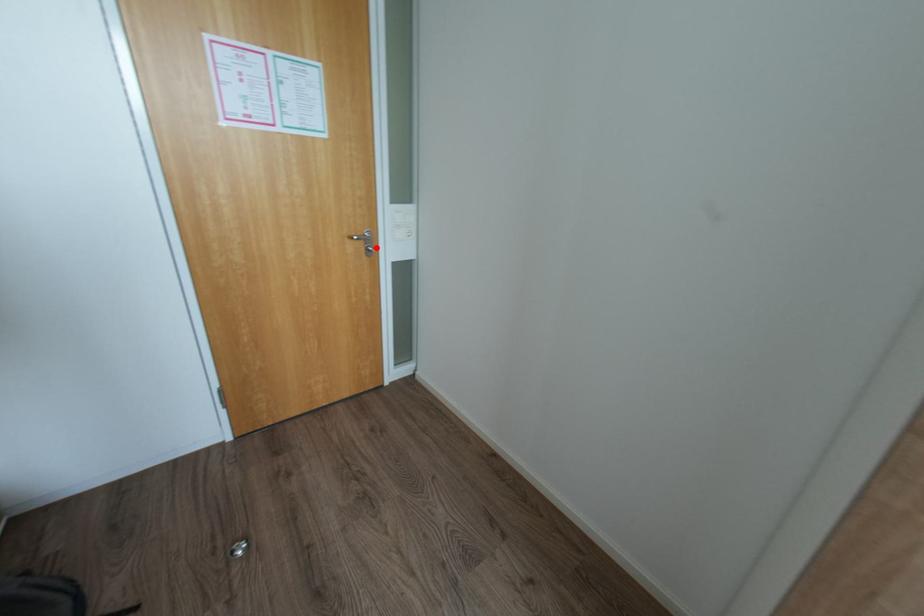
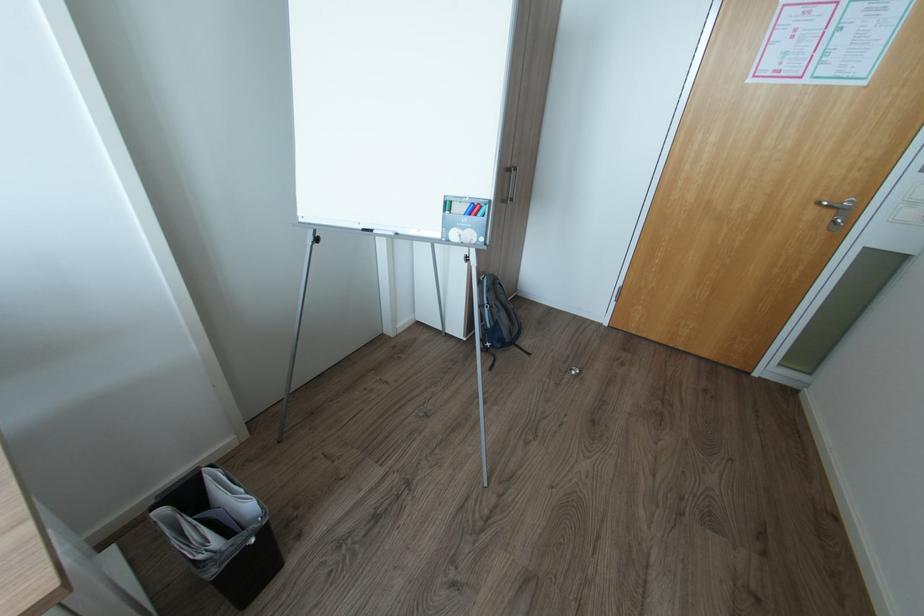
Find the pixel in the second image that matches the highlighted location in the first image.

(845, 221)